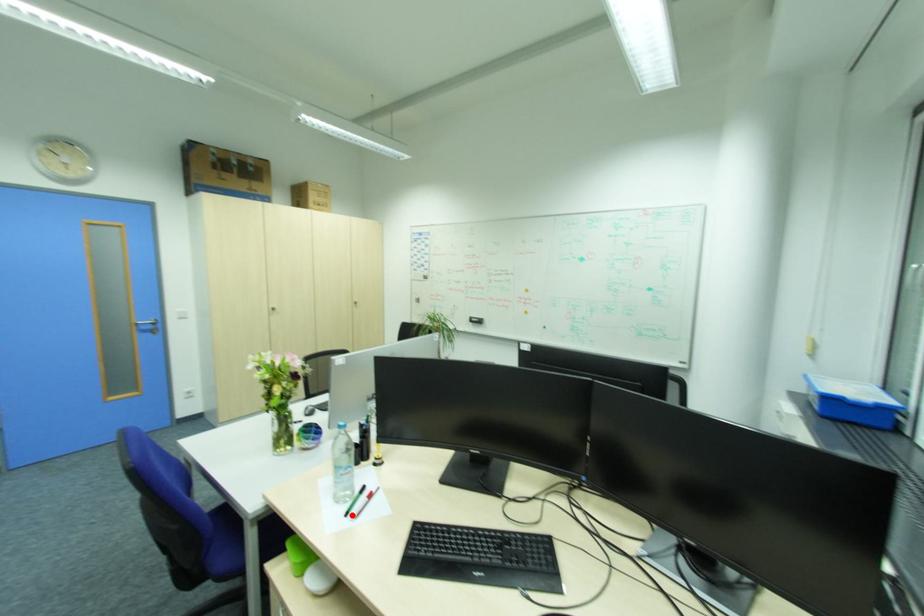
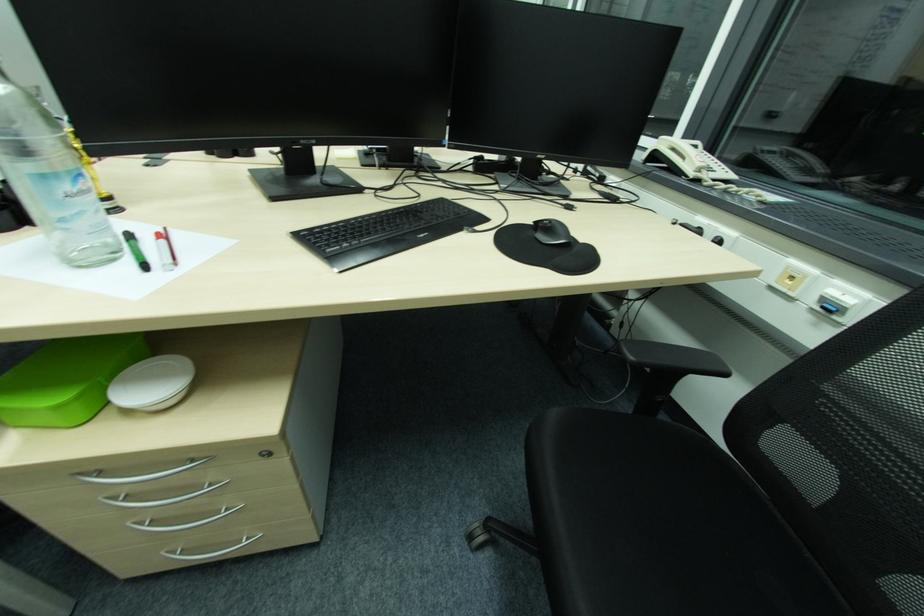
Question: I am providing you with two images of the same scene from different viewpoints. A red point is marked on the first image. Is the red point's position out of view in image 2?

Choices:
 (A) Yes
 (B) No

Answer: (B)